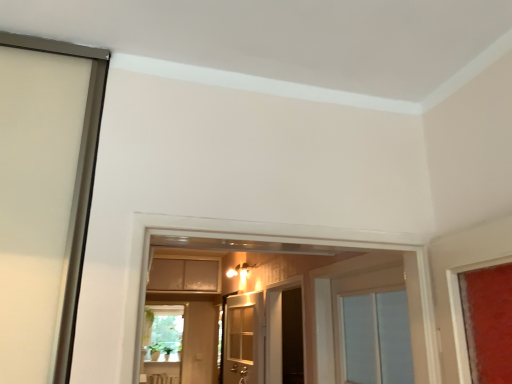
Find the location of a particular element. The image size is (512, 384). white wooden door at center is located at coordinates (243, 339).

What do you see at coordinates (243, 339) in the screenshot?
I see `white wooden door at center` at bounding box center [243, 339].

The width and height of the screenshot is (512, 384). What do you see at coordinates (184, 274) in the screenshot?
I see `matte beige cabinet at center` at bounding box center [184, 274].

The height and width of the screenshot is (384, 512). I want to click on dark wood screen door at center, so click(276, 327).

What's the angular difference between dark wood screen door at center and white wooden door at center's facing directions?

dark wood screen door at center and white wooden door at center are facing 76.7 degrees away from each other.

Is dark wood screen door at center taller than white wooden door at center?

Yes.

In the image, is dark wood screen door at center positioned in front of or behind white wooden door at center?

Visually, dark wood screen door at center is located behind white wooden door at center.

Is dark wood screen door at center in contact with white wooden door at center?

There is a gap between dark wood screen door at center and white wooden door at center.

Is matte beige cabinet at center positioned behind dark wood screen door at center?

Yes, the depth of matte beige cabinet at center is greater than that of dark wood screen door at center.

Does matte beige cabinet at center have a lesser width compared to dark wood screen door at center?

No.

Is matte beige cabinet at center not within dark wood screen door at center?

matte beige cabinet at center is positioned outside dark wood screen door at center.

Can you confirm if matte beige cabinet at center is smaller than dark wood screen door at center?

No.

Is white wooden door at center beside matte beige cabinet at center?

No, white wooden door at center is not making contact with matte beige cabinet at center.

Based on the photo, from the image's perspective, is white wooden door at center located above or below matte beige cabinet at center?

white wooden door at center is situated lower than matte beige cabinet at center in the image.

In the scene shown: Considering their positions, is white wooden door at center located in front of or behind matte beige cabinet at center?

white wooden door at center is in front of matte beige cabinet at center.

Which object is further away from the camera, matte beige cabinet at center or white wooden door at center?

matte beige cabinet at center is behind.

Considering the relative sizes of matte beige cabinet at center and white wooden door at center in the image provided, is matte beige cabinet at center taller than white wooden door at center?

No.

Is matte beige cabinet at center positioned with its back to white wooden door at center?

matte beige cabinet at center is not turned away from white wooden door at center.

Looking at this image, does matte beige cabinet at center touch white wooden door at center?

matte beige cabinet at center is not next to white wooden door at center, and they're not touching.

Is dark wood screen door at center at the back of white wooden door at center?

Yes, white wooden door at center is facing away from dark wood screen door at center.

Which is more to the right, white wooden door at center or dark wood screen door at center?

dark wood screen door at center is more to the right.

Is white wooden door at center next to dark wood screen door at center?

No.

From the image's perspective, which object appears higher, white wooden door at center or dark wood screen door at center?

white wooden door at center, from the image's perspective.

Which object is positioned more to the left, dark wood screen door at center or matte beige cabinet at center?

matte beige cabinet at center is more to the left.

Is point (274, 378) positioned in front of point (209, 276)?

Yes.

Based on the photo, is dark wood screen door at center shorter than matte beige cabinet at center?

No.

In order to click on screen door that is below the matte beige cabinet at center (from the image's perspective) in this screenshot , I will do `click(276, 327)`.

This screenshot has height=384, width=512. Identify the location of screen door positioned vertically above the white wooden door at center (from a real-world perspective). (276, 327).

At what (x,y) coordinates should I click in order to perform the action: click on cabinetry that is above the dark wood screen door at center (from the image's perspective). Please return your answer as a coordinate pair (x, y). The width and height of the screenshot is (512, 384). Looking at the image, I should click on (184, 274).

Estimate the real-world distances between objects in this image. Which object is closer to white wooden door at center, matte beige cabinet at center or dark wood screen door at center?

dark wood screen door at center is positioned closer to the anchor white wooden door at center.

Based on their spatial positions, is dark wood screen door at center or matte beige cabinet at center closer to white wooden door at center?

dark wood screen door at center.

From the image, which object appears to be farther from matte beige cabinet at center, dark wood screen door at center or white wooden door at center?

Among the two, dark wood screen door at center is located further to matte beige cabinet at center.

Looking at the image, which one is located further to dark wood screen door at center, matte beige cabinet at center or white wooden door at center?

matte beige cabinet at center is positioned further to the anchor dark wood screen door at center.

From the image, which object appears to be farther from matte beige cabinet at center, white wooden door at center or dark wood screen door at center?

dark wood screen door at center is further to matte beige cabinet at center.

Considering their positions, is white wooden door at center positioned further to dark wood screen door at center than matte beige cabinet at center?

matte beige cabinet at center is positioned further to the anchor dark wood screen door at center.

At what (x,y) coordinates should I click in order to perform the action: click on screen door between white wooden door at center and matte beige cabinet at center in the front-back direction. Please return your answer as a coordinate pair (x, y). Looking at the image, I should click on (276, 327).